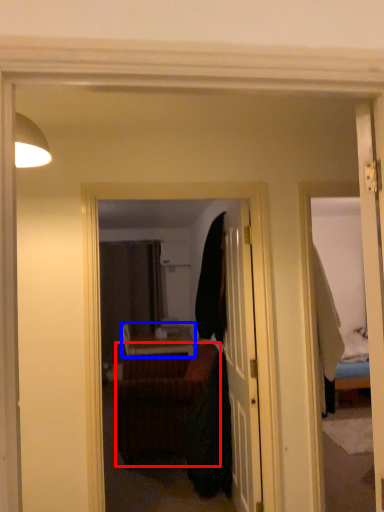
Question: Which object appears farthest to the camera in this image, studio couch (highlighted by a red box) or table (highlighted by a blue box)?

Choices:
 (A) studio couch
 (B) table

Answer: (B)